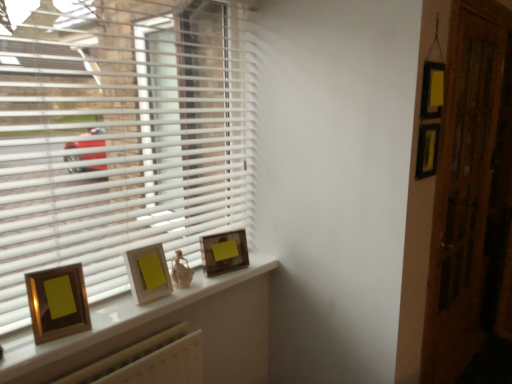
Question: Does point (130, 276) appear closer or farther from the camera than point (227, 246)?

Choices:
 (A) closer
 (B) farther

Answer: (A)

Question: Is matte gold picture frame at center, marked as the 2th picture frame in a left-to-right arrangement, inside or outside of matte gold picture frame at center, the third picture frame positioned from the front?

Choices:
 (A) inside
 (B) outside

Answer: (B)

Question: Which of these objects is positioned closest to the wooden glossy picture frame at left, which is counted as the 3th picture frame, starting from the back?

Choices:
 (A) white plastic blinds at left
 (B) matte gold picture frame at center, which is the 2th picture frame in back-to-front order
 (C) gold-framed picture at center
 (D) wooden screen door at right
 (E) matte gold picture frame at center, the first picture frame from the back

Answer: (B)

Question: Considering the real-world distances, which object is closest to the wooden glossy picture frame at left, which is counted as the first picture frame, starting from the left?

Choices:
 (A) matte gold picture frame at center, placed as the 3th picture frame when sorted from left to right
 (B) gold-framed picture at center
 (C) matte gold picture frame at center, which appears as the second picture frame when viewed from the front
 (D) white plastic blinds at left
 (E) wooden screen door at right

Answer: (C)